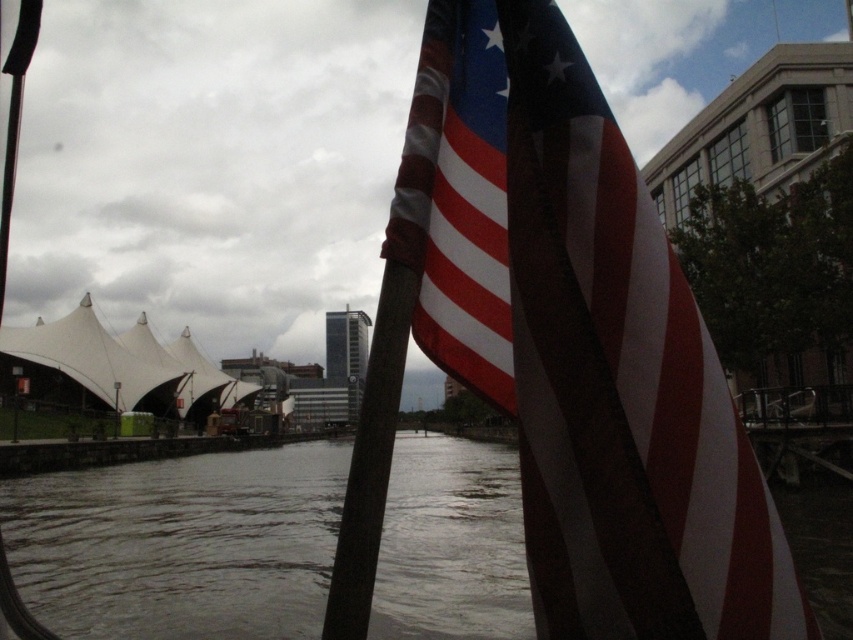
Is american flag at upper right to the left of dark gray water at center from the viewer's perspective?

No, american flag at upper right is not to the left of dark gray water at center.

Does american flag at upper right have a larger size compared to dark gray water at center?

No, american flag at upper right is not bigger than dark gray water at center.

Is point (625, 256) farther from viewer compared to point (173, 611)?

No, (625, 256) is in front of (173, 611).

What are the coordinates of `american flag at upper right` in the screenshot? It's located at (579, 340).

What do you see at coordinates (579, 340) in the screenshot? I see `american flag at upper right` at bounding box center [579, 340].

Does american flag at upper right have a lesser height compared to dark brown wooden pole at center?

Indeed, american flag at upper right has a lesser height compared to dark brown wooden pole at center.

The width and height of the screenshot is (853, 640). I want to click on american flag at upper right, so pos(579,340).

Does dark gray water at center appear on the right side of dark brown wooden pole at center?

In fact, dark gray water at center is to the left of dark brown wooden pole at center.

Who is more forward, (479, 532) or (358, 586)?

Positioned in front is point (358, 586).

Where is `dark gray water at center`? dark gray water at center is located at coordinates (180, 545).